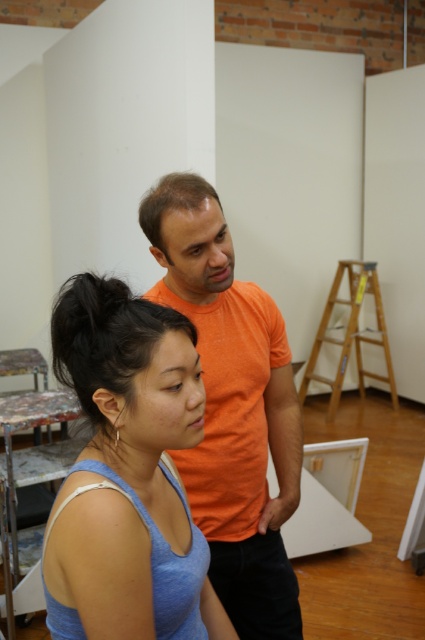
Question: Which object appears farthest from the camera in this image?

Choices:
 (A) blue cotton tank top at lower left
 (B) orange cotton shirt at upper center
 (C) black shiny hair at center
 (D) wooden ladder at right

Answer: (D)

Question: Which point is closer to the camera?

Choices:
 (A) (197, 324)
 (B) (70, 308)
 (C) (388, 376)

Answer: (B)

Question: Which object is closer to the camera taking this photo?

Choices:
 (A) brown matte hair at upper center
 (B) black shiny hair at center
 (C) wooden ladder at right
 (D) orange cotton shirt at upper center

Answer: (B)

Question: Can you confirm if blue cotton tank top at lower left is bigger than orange cotton shirt at upper center?

Choices:
 (A) no
 (B) yes

Answer: (A)

Question: Can you confirm if orange cotton shirt at upper center is bigger than wooden ladder at right?

Choices:
 (A) no
 (B) yes

Answer: (A)

Question: Is the position of orange cotton shirt at upper center less distant than that of brown matte hair at upper center?

Choices:
 (A) yes
 (B) no

Answer: (B)